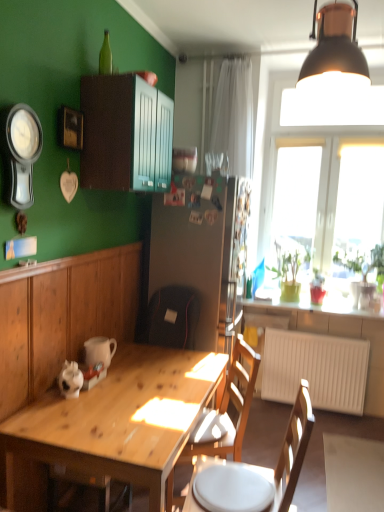
Question: Is metallic silver clock at upper left situated inside green matte plant at window, the 1th houseplant in the back-to-front sequence, or outside?

Choices:
 (A) inside
 (B) outside

Answer: (B)

Question: Does point (16, 133) appear closer or farther from the camera than point (284, 285)?

Choices:
 (A) closer
 (B) farther

Answer: (A)

Question: Which object is positioned farthest from the wooden picture frame at upper left?

Choices:
 (A) wooden chair at center, the second chair when ordered from back to front
 (B) green matte plant at window, which ranks as the second houseplant in right-to-left order
 (C) black matte lampshade at upper right
 (D) matte wood cabinet at upper center, which is counted as the 1th cabinetry, starting from the top
 (E) transparent glass window at upper right

Answer: (B)

Question: Estimate the real-world distances between objects in this image. Which object is farther from the green matte plant at window, which ranks as the second houseplant in right-to-left order?

Choices:
 (A) wooden picture frame at upper left
 (B) wooden desk at lower left
 (C) wooden table at lower left, which appears as the first cabinetry when ordered from the bottom
 (D) matte wood cabinet at upper center, which is counted as the 1th cabinetry, starting from the top
 (E) metallic silver bowl at upper center

Answer: (A)